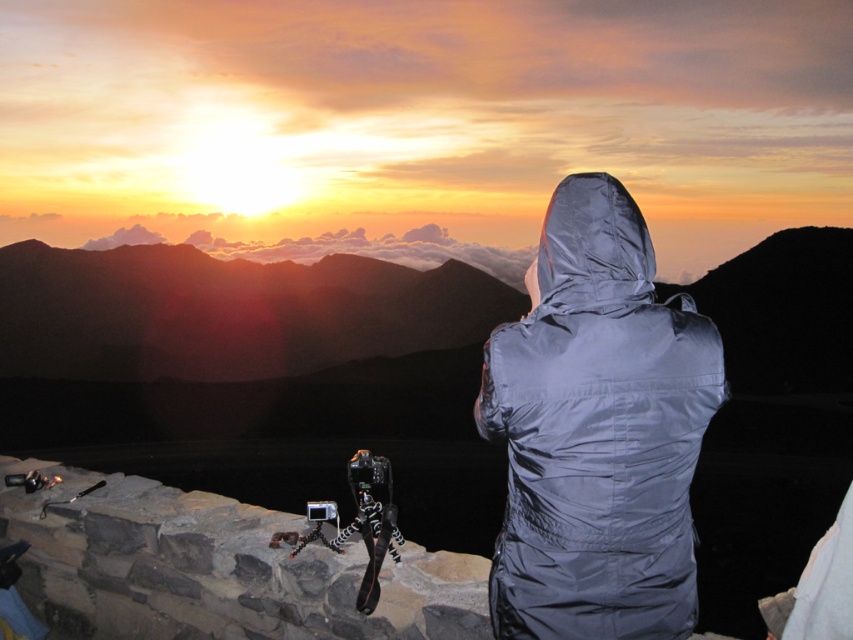
What do you see at coordinates (596, 432) in the screenshot?
I see `gray synthetic jacket at center` at bounding box center [596, 432].

Measure the distance between gray synthetic jacket at center and glossy silver hood at center.

gray synthetic jacket at center is 6.81 inches from glossy silver hood at center.

Which is in front, point (578, 339) or point (560, 195)?

Point (578, 339) is more forward.

Identify the location of gray synthetic jacket at center. Image resolution: width=853 pixels, height=640 pixels. (596, 432).